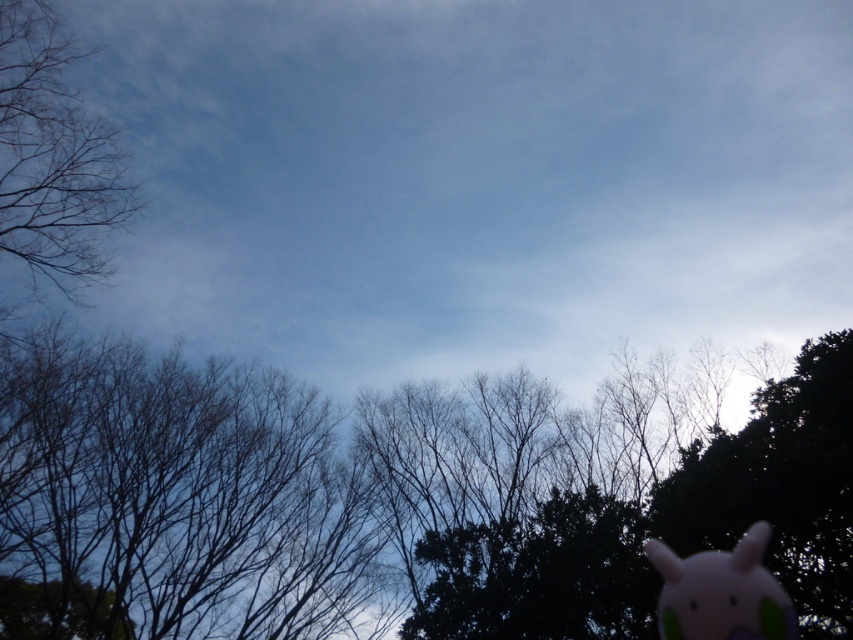
Can you confirm if green leafy tree at center is positioned to the left of pink plush toy at lower right?

Correct, you'll find green leafy tree at center to the left of pink plush toy at lower right.

Is point (55, 388) more distant than point (786, 596)?

That is True.

Is point (720, 365) closer to viewer compared to point (741, 556)?

No, (720, 365) is further to viewer.

Locate an element on the screen. The image size is (853, 640). green leafy tree at center is located at coordinates (395, 497).

Looking at this image, is green leafy tree at center thinner than bare branches at left?

No.

Where is `green leafy tree at center`? The width and height of the screenshot is (853, 640). green leafy tree at center is located at coordinates (395, 497).

The image size is (853, 640). Find the location of `green leafy tree at center`. green leafy tree at center is located at coordinates (395, 497).

Is bare branches at left to the right of pink plush toy at lower right from the viewer's perspective?

No, bare branches at left is not to the right of pink plush toy at lower right.

This screenshot has width=853, height=640. In order to click on bare branches at left in this screenshot , I will do `click(53, 156)`.